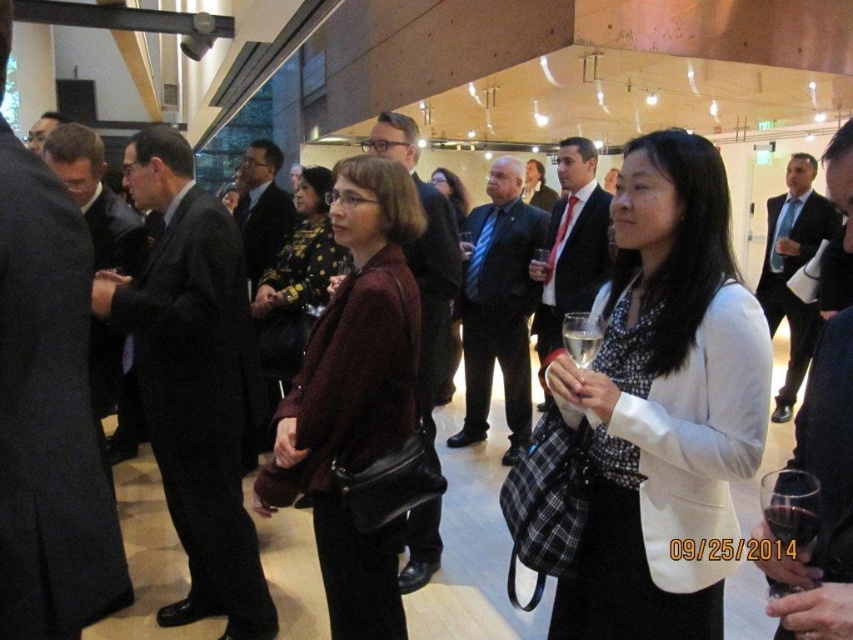
Question: Which of the following is the farthest from the observer?

Choices:
 (A) dark brown leather jacket at center
 (B) matte brown coat at center
 (C) maroon woolen jacket at center
 (D) clear glass wine at center

Answer: (B)

Question: Is white matte blazer at center wider than maroon woolen jacket at center?

Choices:
 (A) no
 (B) yes

Answer: (A)

Question: Which point is closer to the camera?

Choices:
 (A) maroon woolen jacket at center
 (B) dark red glass at center
 (C) clear glass wine at center

Answer: (B)

Question: Considering the real-world distances, which object is closest to the matte brown coat at center?

Choices:
 (A) white matte blazer at center
 (B) dark red glass at center

Answer: (A)

Question: Can you confirm if dark brown leather jacket at center is smaller than dark red glass at center?

Choices:
 (A) yes
 (B) no

Answer: (B)

Question: Can you confirm if white matte blazer at center is positioned below dark red glass at center?

Choices:
 (A) yes
 (B) no

Answer: (B)